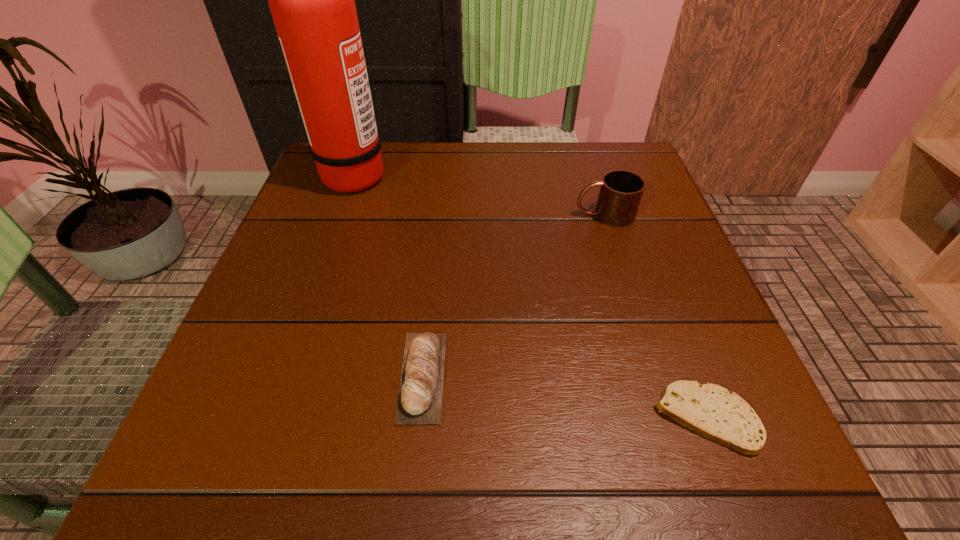
What are the coordinates of `vacant area that lies between the third tallest object and the right pita bread` in the screenshot? It's located at (564, 396).

Find the location of `unoccupied area between the right pita bread and the left pita bread`. unoccupied area between the right pita bread and the left pita bread is located at coordinates (564, 396).

You are a GUI agent. You are given a task and a screenshot of the screen. Output one action in this format:
    pyautogui.click(x=<x>, y=<y>)
    Task: Click on the free point between the shorter pita bread and the third shortest object
    
    Given the screenshot: What is the action you would take?
    pyautogui.click(x=655, y=316)

I want to click on blank region between the leftmost object and the left pita bread, so click(389, 275).

Find the location of a particular element. This screenshot has height=540, width=960. vacant area between the second object from left to right and the tallest object is located at coordinates (389, 275).

Where is `object identified as the second closest to the second shortest object`? This screenshot has width=960, height=540. object identified as the second closest to the second shortest object is located at coordinates (312, 0).

Image resolution: width=960 pixels, height=540 pixels. Identify the location of the third closest object to the second tallest object. (312, 0).

Identify the location of vacant area in the image that satisfies the following two spatial constraints: 1. on the back side of the shorter pita bread; 2. on the handle side of the fire extinguisher. (613, 174).

The width and height of the screenshot is (960, 540). I want to click on vacant space that satisfies the following two spatial constraints: 1. on the handle side of the fire extinguisher; 2. on the right side of the shorter pita bread, so click(270, 417).

The width and height of the screenshot is (960, 540). I want to click on free region that satisfies the following two spatial constraints: 1. on the handle side of the tallest object; 2. on the left side of the shorter pita bread, so click(x=270, y=417).